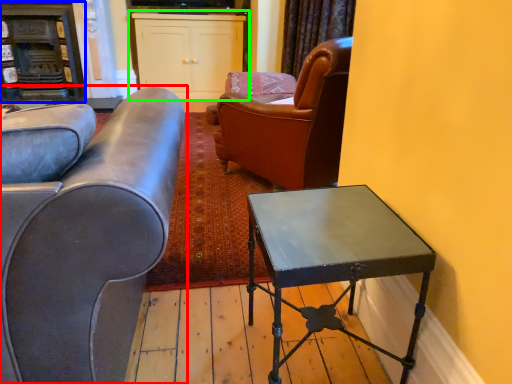
Question: Based on their relative distances, which object is nearer to studio couch (highlighted by a red box)? Choose from fireplace (highlighted by a blue box) and cabinetry (highlighted by a green box).

Choices:
 (A) fireplace
 (B) cabinetry

Answer: (B)